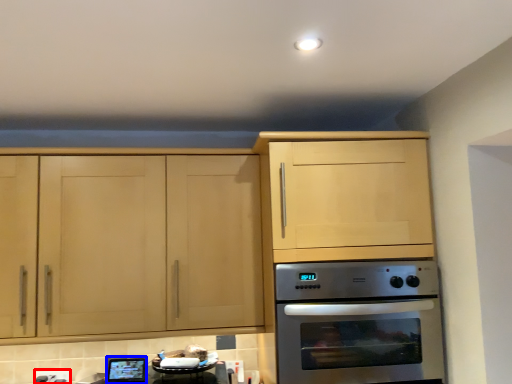
Question: Which of the following is the farthest to the observer, electric outlet (highlighted by a red box) or appliance (highlighted by a blue box)?

Choices:
 (A) electric outlet
 (B) appliance

Answer: (A)